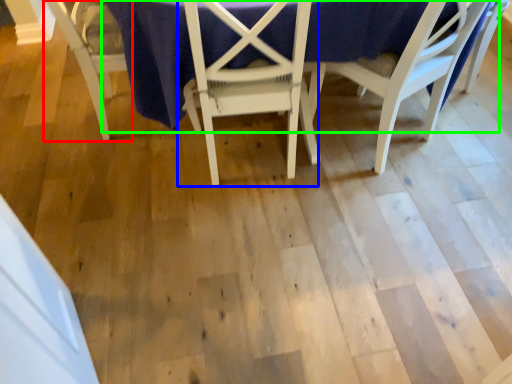
Question: Which is farther away from chair (highlighted by a red box)? chair (highlighted by a blue box) or table (highlighted by a green box)?

Choices:
 (A) chair
 (B) table

Answer: (A)